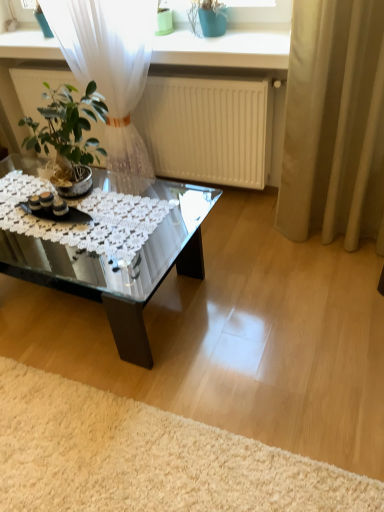
Locate an element on the screen. Image resolution: width=384 pixels, height=512 pixels. free space to the left of beige fabric curtain at right is located at coordinates (283, 263).